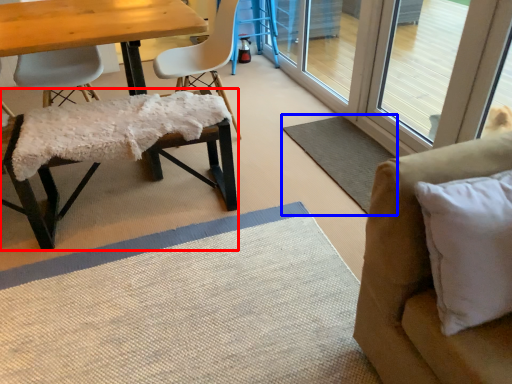
Question: Among these objects, which one is farthest to the camera, chair (highlighted by a red box) or mat (highlighted by a blue box)?

Choices:
 (A) chair
 (B) mat

Answer: (B)